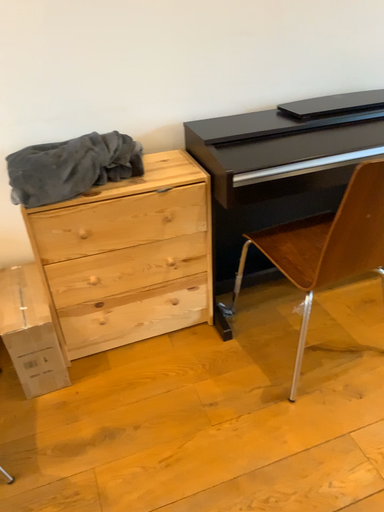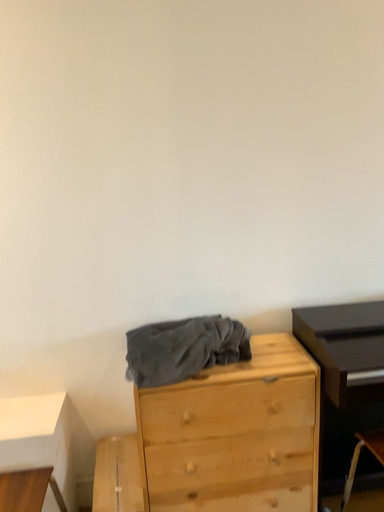
Question: Which way did the camera rotate in the video?

Choices:
 (A) rotated downward
 (B) rotated upward

Answer: (B)